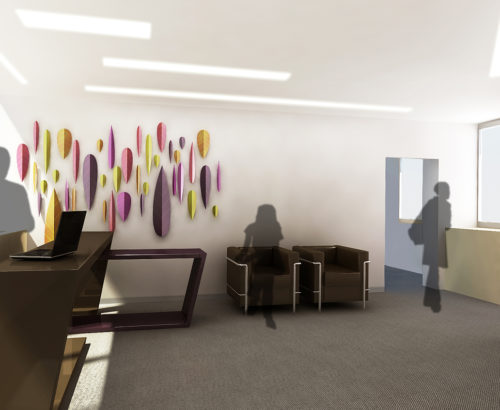
Identify the location of chair. (278, 292), (349, 289).